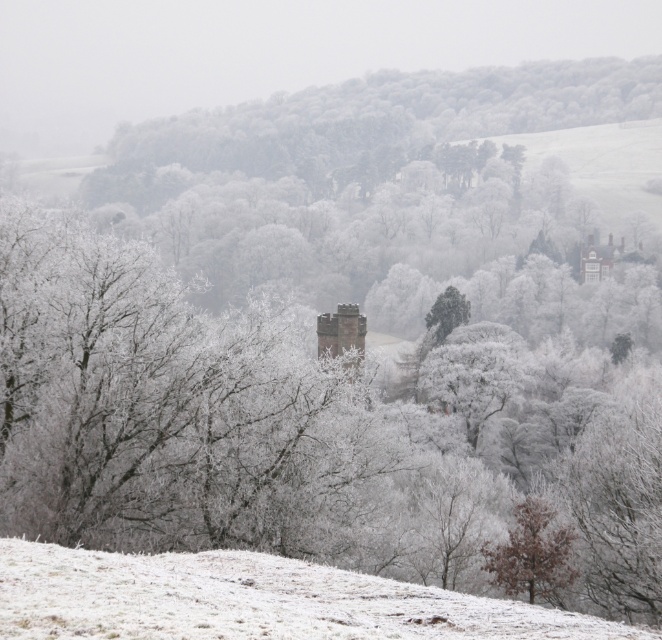
Is point (432, 112) farther from camera compared to point (371, 580)?

Yes, point (432, 112) is behind point (371, 580).

This screenshot has width=662, height=640. Find the location of `frosted white trees at center`. frosted white trees at center is located at coordinates (369, 124).

The image size is (662, 640). Describe the element at coordinates (369, 124) in the screenshot. I see `frosted white trees at center` at that location.

Identify the location of frosted white trees at center. The height and width of the screenshot is (640, 662). (369, 124).

How distant is snowy grass at lower left from green textured tree at center?

The distance of snowy grass at lower left from green textured tree at center is 100.09 meters.

Is point (263, 636) more distant than point (448, 300)?

No, (263, 636) is in front of (448, 300).

I want to click on snowy grass at lower left, so click(252, 600).

Does point (68, 376) lie in front of point (569, 618)?

No, it is not.

Does frosted branches at center lie behind snowy grass at lower left?

That is True.

Does point (66, 470) lie in front of point (77, 620)?

No, (66, 470) is behind (77, 620).

Locate an element on the screen. frosted branches at center is located at coordinates (171, 412).